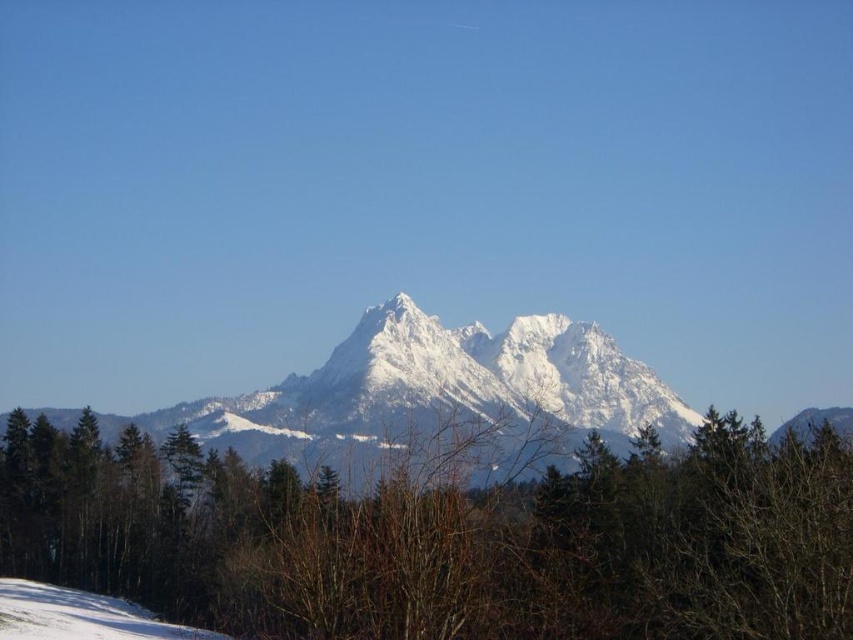
Question: Which point is closer to the camera taking this photo?

Choices:
 (A) (207, 545)
 (B) (221, 636)

Answer: (B)

Question: Can you confirm if green matte tree at center is positioned below white snow at lower left?

Choices:
 (A) no
 (B) yes

Answer: (A)

Question: Among these points, which one is nearest to the camera?

Choices:
 (A) (550, 524)
 (B) (24, 589)

Answer: (A)

Question: Is green matte tree at center bigger than white snow at lower left?

Choices:
 (A) no
 (B) yes

Answer: (B)

Question: Can you confirm if green matte tree at center is positioned above white snow at lower left?

Choices:
 (A) yes
 (B) no

Answer: (A)